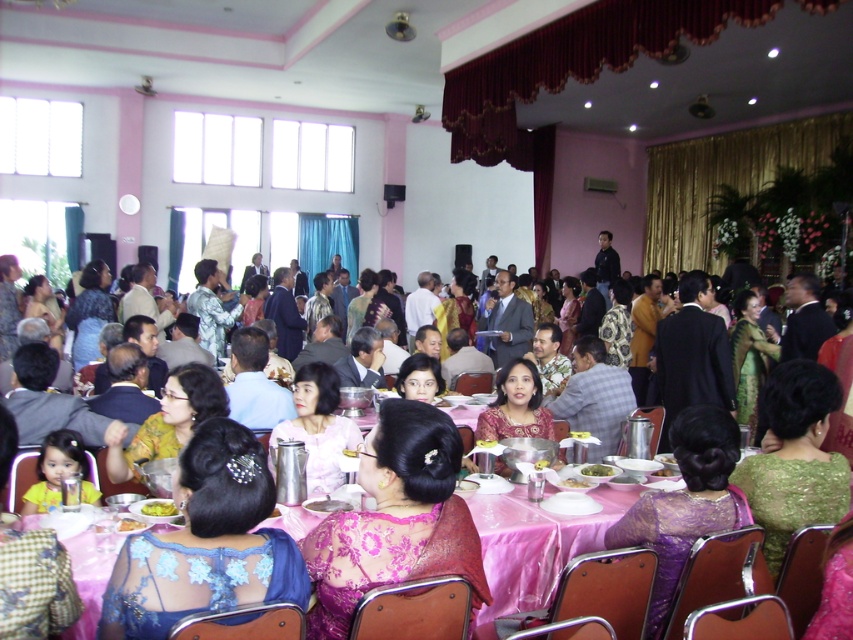
You are standing at the entrance of the hall and want to find the purple lace dress at center. According to the coordinates given, in which direction should you walk to reach it?

The purple lace dress at center is located at coordinates point (x=685, y=502). Since you are at the entrance, you should walk towards the center of the hall to reach it.

You are standing at the entrance of the hall and want to take a photo of the point marked at coordinates (660, 630). The camera you are using has a maximum focus range of 8 feet. Will the camera be able to focus on the point?

The point at coordinates (660, 630) is 8.29 feet away from the camera. Since the camera can only focus up to 8 feet, it will not be able to focus on the point.